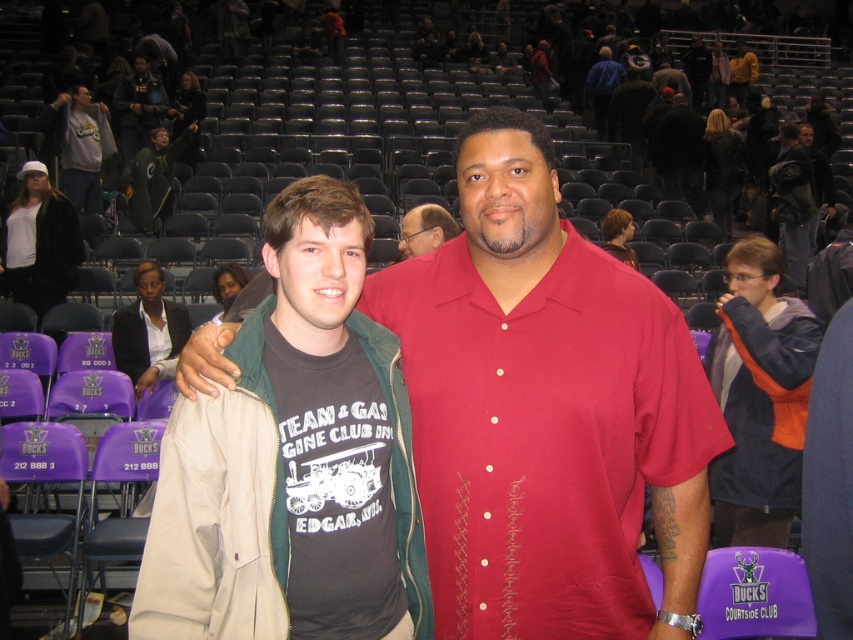
You are a photographer at the Milwaukee Bucks game. You notice the dark gray jacket at upper right and the matte gray hoodie at upper left in your camera viewfinder. Which clothing item is positioned lower in the frame?

The dark gray jacket at upper right is located below the matte gray hoodie at upper left, so it is positioned lower in the frame.

You are a photographer setting up for a basketball game photo shoot. You have two jackets to place in the frame. The khaki jacket at center and the matte gray hoodie at upper left. Which jacket should you choose to place closer to the camera to ensure it appears larger in the photo?

The khaki jacket at center is not as tall as the matte gray hoodie at upper left. To make the jacket appear larger in the photo, place the khaki jacket at center closer to the camera since smaller objects need to be nearer to appear larger.

You are standing at the point with coordinates point (x=59, y=122) and want to walk to the point with coordinates point (x=792, y=241). Based on the scene description, will you have to walk towards the front or the back of the image?

You will have to walk towards the front of the image because point (x=792, y=241) is in front of point (x=59, y=122).